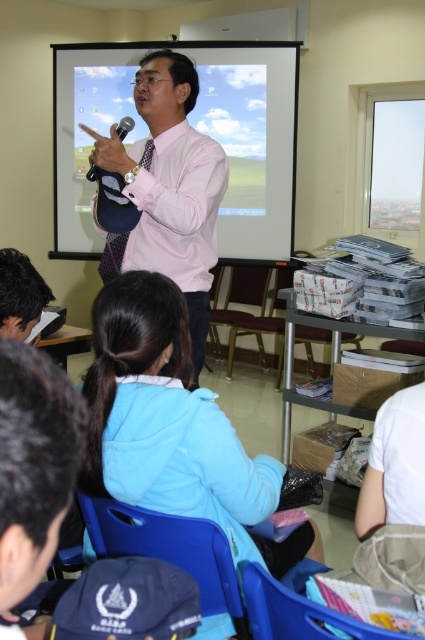
Which is above, pink shirt at center or matte black microphone at upper center?

matte black microphone at upper center is higher up.

Which is in front, point (173, 125) or point (130, 125)?

Point (130, 125) is in front.

You are a GUI agent. You are given a task and a screenshot of the screen. Output one action in this format:
    pyautogui.click(x=<x>, y=<y>)
    Task: Click on the pink shirt at center
    The width and height of the screenshot is (425, 640).
    Given the screenshot: What is the action you would take?
    pyautogui.click(x=169, y=189)

Does blue fleece jacket at lower center have a smaller size compared to matte black microphone at upper center?

No, blue fleece jacket at lower center is not smaller than matte black microphone at upper center.

Which is more to the left, blue fleece jacket at lower center or matte black microphone at upper center?

matte black microphone at upper center is more to the left.

Who is more forward, (x=258, y=560) or (x=124, y=132)?

Point (x=258, y=560)

Locate an element on the screen. The width and height of the screenshot is (425, 640). blue fleece jacket at lower center is located at coordinates (172, 426).

Is point (93, 468) farther from camera compared to point (215, 45)?

No.

Does blue fleece jacket at lower center have a larger size compared to white matte projection screen at upper center?

Incorrect, blue fleece jacket at lower center is not larger than white matte projection screen at upper center.

Who is more distant from viewer, (193, 484) or (85, 68)?

The point (85, 68) is more distant.

Where is `blue fleece jacket at lower center`? blue fleece jacket at lower center is located at coordinates (172, 426).